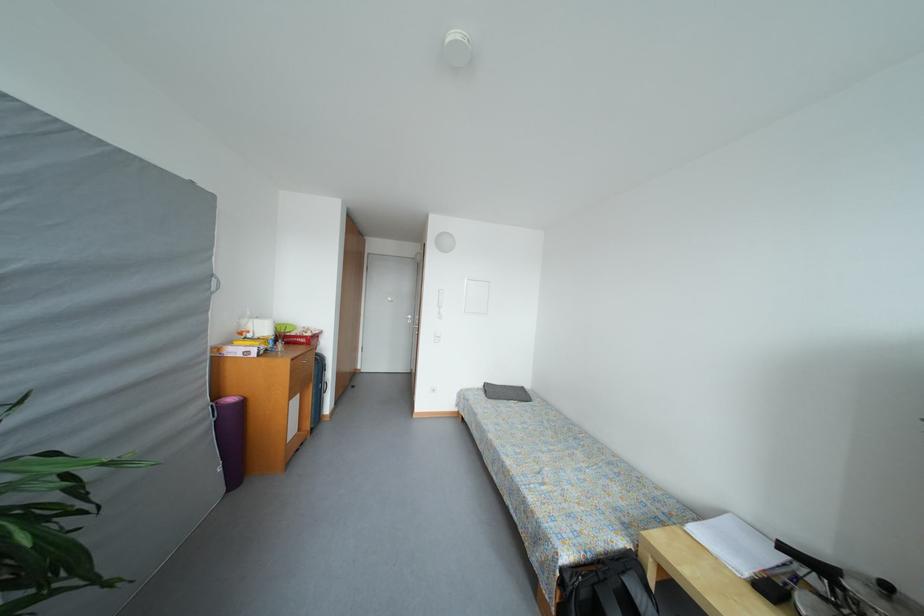
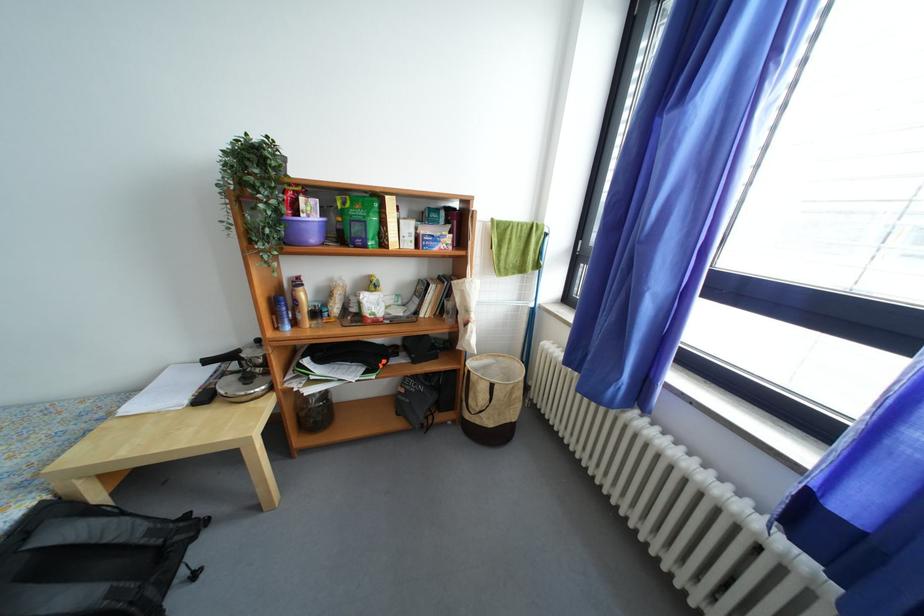
Locate, in the second image, the point that corresponds to the point at 823,586 in the first image.

(240, 371)